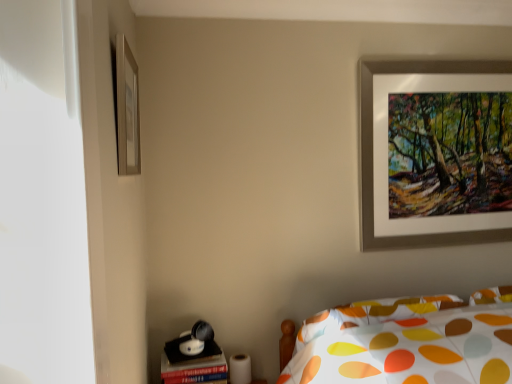
Question: Is silver metallic picture frame at upper left, which ranks as the 2th picture frame in back-to-front order, oriented towards silver metallic picture frame at upper right, acting as the second picture frame starting from the left?

Choices:
 (A) yes
 (B) no

Answer: (A)

Question: Does silver metallic picture frame at upper left, acting as the first picture frame starting from the front, have a greater height compared to silver metallic picture frame at upper right, which ranks as the first picture frame in right-to-left order?

Choices:
 (A) yes
 (B) no

Answer: (B)

Question: From a real-world perspective, does silver metallic picture frame at upper left, positioned as the second picture frame in right-to-left order, sit lower than silver metallic picture frame at upper right, the 1th picture frame when ordered from back to front?

Choices:
 (A) no
 (B) yes

Answer: (A)

Question: Would you consider silver metallic picture frame at upper left, which ranks as the 2th picture frame in back-to-front order, to be distant from silver metallic picture frame at upper right, acting as the second picture frame starting from the left?

Choices:
 (A) yes
 (B) no

Answer: (A)

Question: Is silver metallic picture frame at upper left, marked as the 1th picture frame in a left-to-right arrangement, positioned behind silver metallic picture frame at upper right, the 1th picture frame when ordered from back to front?

Choices:
 (A) no
 (B) yes

Answer: (A)

Question: From the image's perspective, is silver metallic picture frame at upper left, marked as the 1th picture frame in a left-to-right arrangement, beneath silver metallic picture frame at upper right, which is counted as the second picture frame, starting from the front?

Choices:
 (A) yes
 (B) no

Answer: (B)

Question: Does silver metallic picture frame at upper left, marked as the 1th picture frame in a left-to-right arrangement, have a lesser width compared to matte black table at lower left?

Choices:
 (A) yes
 (B) no

Answer: (A)

Question: Is silver metallic picture frame at upper left, marked as the 1th picture frame in a left-to-right arrangement, bigger than matte black table at lower left?

Choices:
 (A) no
 (B) yes

Answer: (A)

Question: Is silver metallic picture frame at upper left, positioned as the second picture frame in right-to-left order, located outside matte black table at lower left?

Choices:
 (A) no
 (B) yes

Answer: (B)

Question: Does silver metallic picture frame at upper left, which ranks as the 2th picture frame in back-to-front order, have a smaller size compared to matte black table at lower left?

Choices:
 (A) no
 (B) yes

Answer: (B)

Question: Does silver metallic picture frame at upper left, acting as the first picture frame starting from the front, appear on the right side of matte black table at lower left?

Choices:
 (A) no
 (B) yes

Answer: (A)

Question: From the image's perspective, is silver metallic picture frame at upper left, which ranks as the 2th picture frame in back-to-front order, over matte black table at lower left?

Choices:
 (A) no
 (B) yes

Answer: (B)

Question: From the image's perspective, does silver metallic picture frame at upper right, the 1th picture frame when ordered from back to front, appear higher than silver metallic picture frame at upper left, positioned as the second picture frame in right-to-left order?

Choices:
 (A) yes
 (B) no

Answer: (B)